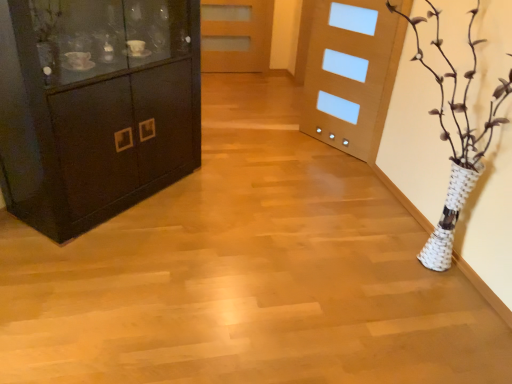
You are a GUI agent. You are given a task and a screenshot of the screen. Output one action in this format:
    pyautogui.click(x=<x>, y=<y>)
    Task: Click on the free space underneath matte wood door at center (from a real-world perspective)
    Image resolution: width=512 pixels, height=384 pixels.
    Given the screenshot: What is the action you would take?
    pyautogui.click(x=234, y=68)